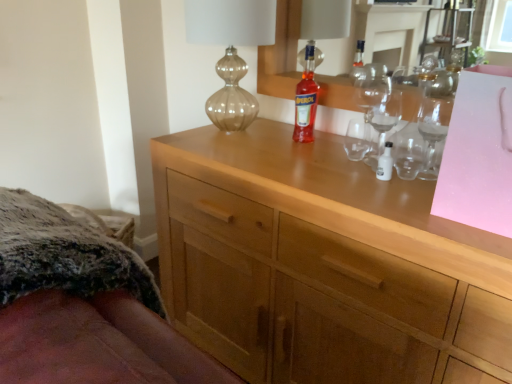
This screenshot has height=384, width=512. Describe the element at coordinates (322, 264) in the screenshot. I see `light wood cabinet at center` at that location.

Describe the element at coordinates (83, 306) in the screenshot. I see `fuzzy fabric bed at lower left` at that location.

Measure the distance between fuzzy fabric bed at lower left and camera.

The depth of fuzzy fabric bed at lower left is 46.16 centimeters.

Where is `translucent glass bottle at center`? This screenshot has height=384, width=512. translucent glass bottle at center is located at coordinates (306, 99).

From a real-world perspective, is translucent glass bottle at center located beneath light wood cabinet at center?

No.

Is translucent glass bottle at center thinner than light wood cabinet at center?

Indeed, translucent glass bottle at center has a lesser width compared to light wood cabinet at center.

Does point (308, 137) appear closer or farther from the camera than point (317, 223)?

Clearly, point (308, 137) is more distant from the camera than point (317, 223).

In the scene shown: Can you confirm if translucent glass bottle at center is positioned to the left of light wood cabinet at center?

Correct, you'll find translucent glass bottle at center to the left of light wood cabinet at center.

Is translucent glass vase at upper center beside fuzzy fabric bed at lower left?

translucent glass vase at upper center and fuzzy fabric bed at lower left are not in contact.

Is point (216, 71) positioned in front of point (27, 278)?

No, it is not.

From the picture: Which is more to the left, translucent glass vase at upper center or fuzzy fabric bed at lower left?

Positioned to the left is fuzzy fabric bed at lower left.

Does translucent glass vase at upper center have a smaller size compared to fuzzy fabric bed at lower left?

Yes, translucent glass vase at upper center is smaller than fuzzy fabric bed at lower left.

Between translucent glass vase at upper center and translucent glass bottle at center, which one has more height?

translucent glass vase at upper center.

Measure the distance from translucent glass vase at upper center to translucent glass bottle at center.

9.98 inches.

From the image's perspective, is translucent glass vase at upper center beneath translucent glass bottle at center?

No, from the image's perspective, translucent glass vase at upper center is not beneath translucent glass bottle at center.

How many degrees apart are the facing directions of translucent glass vase at upper center and translucent glass bottle at center?

They differ by 4.17 degrees in their facing directions.

Does light wood cabinet at center have a greater width compared to transparent glass wine glass at upper right?

Correct, the width of light wood cabinet at center exceeds that of transparent glass wine glass at upper right.

Which is in front, light wood cabinet at center or transparent glass wine glass at upper right?

light wood cabinet at center is more forward.

What's the angular difference between light wood cabinet at center and transparent glass wine glass at upper right's facing directions?

There is a 1.86-degree angle between the facing directions of light wood cabinet at center and transparent glass wine glass at upper right.

From a real-world perspective, is transparent glass wine glass at upper right physically below translucent glass vase at upper center?

Correct, in the physical world, transparent glass wine glass at upper right is lower than translucent glass vase at upper center.

Which object is thinner, transparent glass wine glass at upper right or translucent glass vase at upper center?

Thinner between the two is transparent glass wine glass at upper right.

Can translucent glass vase at upper center be found inside transparent glass wine glass at upper right?

Actually, translucent glass vase at upper center is outside transparent glass wine glass at upper right.

Do you think transparent glass wine glass at upper right is within fuzzy fabric bed at lower left, or outside of it?

transparent glass wine glass at upper right is not enclosed by fuzzy fabric bed at lower left.

Consider the image. Considering the relative positions of transparent glass wine glass at upper right and fuzzy fabric bed at lower left in the image provided, is transparent glass wine glass at upper right in front of fuzzy fabric bed at lower left?

No, the depth of transparent glass wine glass at upper right is greater than that of fuzzy fabric bed at lower left.

Which object is positioned more to the left, transparent glass wine glass at upper right or fuzzy fabric bed at lower left?

Positioned to the left is fuzzy fabric bed at lower left.

From the image's perspective, which is below, translucent glass vase at upper center or light wood cabinet at center?

light wood cabinet at center, from the image's perspective.

Is point (271, 18) farther from viewer compared to point (421, 286)?

Yes, it is.

Considering the sizes of translucent glass vase at upper center and light wood cabinet at center in the image, is translucent glass vase at upper center wider or thinner than light wood cabinet at center?

In the image, translucent glass vase at upper center appears to be more narrow than light wood cabinet at center.

Identify the location of bottle above the light wood cabinet at center (from the image's perspective). (306, 99).

I want to click on table lamp on the right of the fuzzy fabric bed at lower left, so click(x=231, y=51).

From the image, which object appears to be nearer to translucent glass vase at upper center, fuzzy fabric bed at lower left or transparent glass wine glass at upper right?

transparent glass wine glass at upper right.

Estimate the real-world distances between objects in this image. Which object is closer to fuzzy fabric bed at lower left, translucent glass vase at upper center or transparent glass wine glass at upper right?

The object closer to fuzzy fabric bed at lower left is translucent glass vase at upper center.

Consider the image. When comparing their distances from translucent glass bottle at center, does transparent glass wine glass at upper right or light wood cabinet at center seem closer?

transparent glass wine glass at upper right is closer to translucent glass bottle at center.

From the picture: Considering their positions, is light wood cabinet at center positioned further to translucent glass vase at upper center than transparent glass wine glass at upper right?

The object further to translucent glass vase at upper center is light wood cabinet at center.

Based on their spatial positions, is transparent glass wine glass at upper right or light wood cabinet at center closer to translucent glass vase at upper center?

Based on the image, transparent glass wine glass at upper right appears to be nearer to translucent glass vase at upper center.

From the picture: Looking at the image, which one is located closer to translucent glass bottle at center, fuzzy fabric bed at lower left or translucent glass vase at upper center?

translucent glass vase at upper center is closer to translucent glass bottle at center.

Consider the image. Looking at the image, which one is located further to translucent glass bottle at center, transparent glass wine glass at upper right or translucent glass vase at upper center?

transparent glass wine glass at upper right.

Estimate the real-world distances between objects in this image. Which object is further from transparent glass wine glass at upper right, fuzzy fabric bed at lower left or translucent glass bottle at center?

fuzzy fabric bed at lower left.

Where is `table lamp situated between fuzzy fabric bed at lower left and transparent glass wine glass at upper right from left to right`? This screenshot has height=384, width=512. table lamp situated between fuzzy fabric bed at lower left and transparent glass wine glass at upper right from left to right is located at coordinates (231, 51).

Where is `the chest of drawers located between fuzzy fabric bed at lower left and translucent glass bottle at center in the depth direction`? This screenshot has height=384, width=512. the chest of drawers located between fuzzy fabric bed at lower left and translucent glass bottle at center in the depth direction is located at coordinates [x=322, y=264].

Identify the location of bottle that lies between translucent glass vase at upper center and light wood cabinet at center from top to bottom. This screenshot has width=512, height=384. (306, 99).

This screenshot has height=384, width=512. What are the coordinates of `wine glass between translucent glass bottle at center and light wood cabinet at center vertically` in the screenshot? It's located at (435, 109).